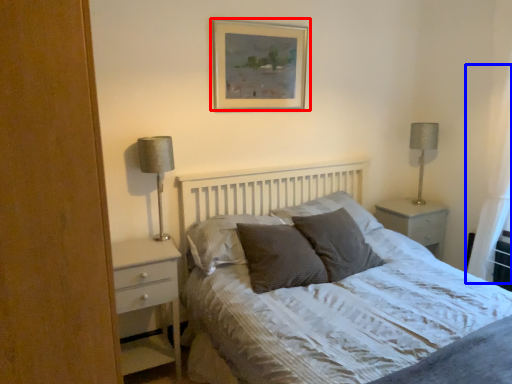
Question: Among these objects, which one is nearest to the camera, picture frame (highlighted by a red box) or curtain (highlighted by a blue box)?

Choices:
 (A) picture frame
 (B) curtain

Answer: (B)